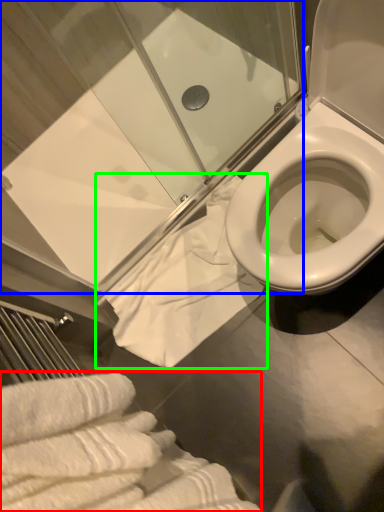
Question: Which object is the farthest from bath towel (highlighted by a red box)? Choose among these: shower door (highlighted by a blue box) or bath towel (highlighted by a green box).

Choices:
 (A) shower door
 (B) bath towel

Answer: (A)